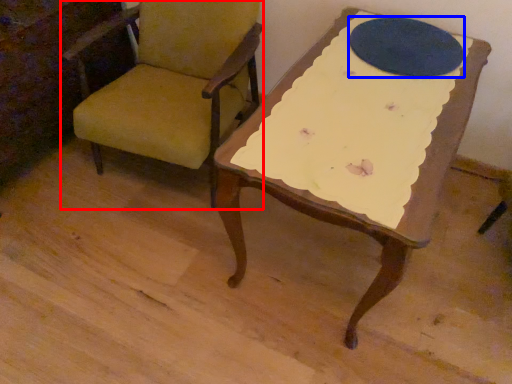
Question: Among these objects, which one is farthest to the camera, chair (highlighted by a red box) or oval (highlighted by a blue box)?

Choices:
 (A) chair
 (B) oval

Answer: (B)